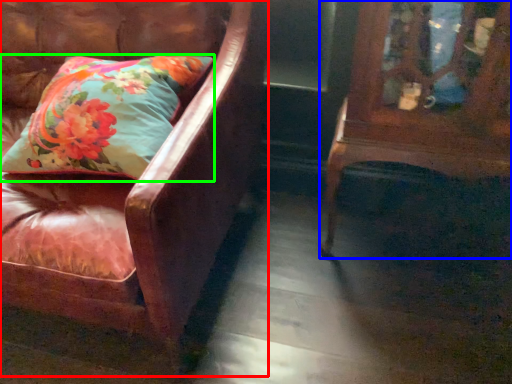
Question: Which is farther away from chair (highlighted by a red box)? furniture (highlighted by a blue box) or pillow (highlighted by a green box)?

Choices:
 (A) furniture
 (B) pillow

Answer: (A)